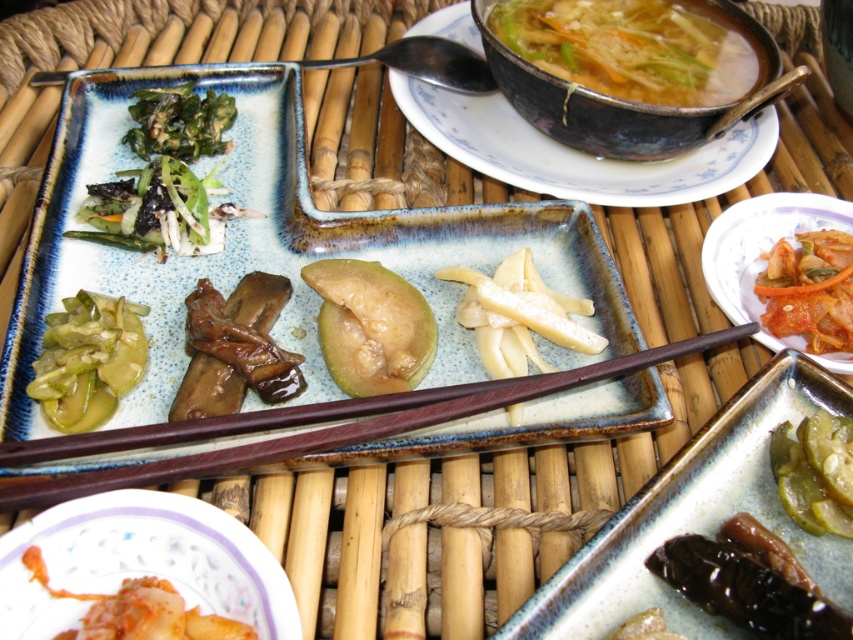
You are a guest at a traditional meal and need to use the brown wood chopsticks at center to serve yourself from the white ceramic bowl at lower left. Can you easily reach the bowl without moving the chopsticks?

The white ceramic bowl at lower left is located below the brown wood chopsticks at center, so you can easily reach it without moving the chopsticks.

You are a food critic who needs to taste the dish in the white ceramic bowl at lower left. You are currently standing 1 meter away from the table. Can you reach the bowl without moving closer?

The white ceramic bowl at lower left is 40.66 centimeters away from the camera. Since you are standing 1 meter away, you can easily reach it without moving closer.

From the picture: You are a guest at a traditional meal and want to reach for the green matte avocado at center and the brown glossy mushrooms at center. Which one can you grab first without moving your hand?

The green matte avocado at center is closer to you than the brown glossy mushrooms at center, so you can grab the green matte avocado at center first without moving your hand.